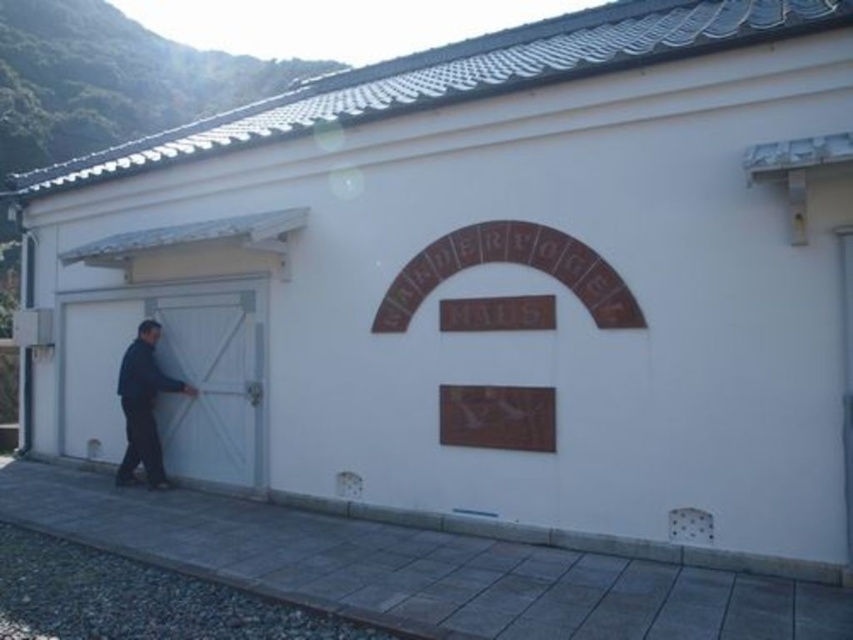
Question: Can you confirm if white matte garage door at left is positioned below dark blue fabric at left?

Choices:
 (A) yes
 (B) no

Answer: (B)

Question: Can you confirm if white matte garage door at left is wider than dark blue fabric at left?

Choices:
 (A) no
 (B) yes

Answer: (B)

Question: Which point is farther to the camera?

Choices:
 (A) (144, 467)
 (B) (254, 324)

Answer: (A)

Question: Which point is closer to the camera taking this photo?

Choices:
 (A) (154, 420)
 (B) (177, 308)

Answer: (A)

Question: Does white matte garage door at left appear on the left side of dark blue fabric at left?

Choices:
 (A) yes
 (B) no

Answer: (A)

Question: Among these points, which one is farthest from the camera?

Choices:
 (A) click(x=126, y=412)
 (B) click(x=73, y=404)

Answer: (B)